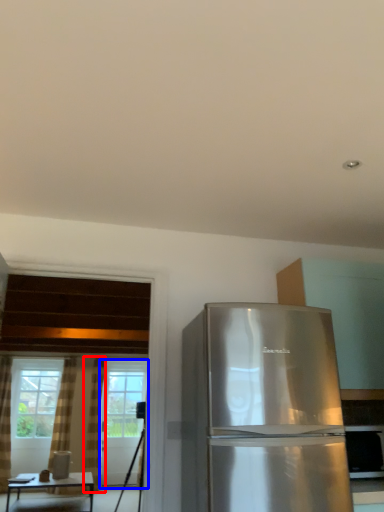
Question: Which object is further to the camera taking this photo, curtain (highlighted by a red box) or screen door (highlighted by a blue box)?

Choices:
 (A) curtain
 (B) screen door

Answer: (B)